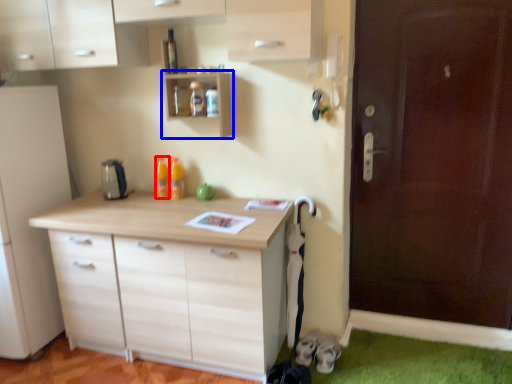
Question: Which point is further to the camera, bottle (highlighted by a red box) or shelf (highlighted by a blue box)?

Choices:
 (A) bottle
 (B) shelf

Answer: (A)